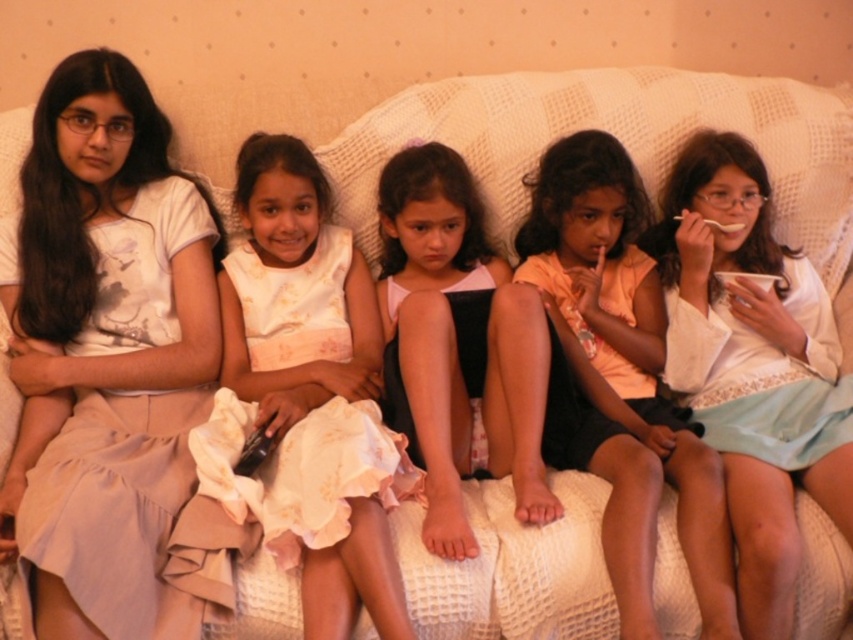
Question: Can you confirm if white cotton dress at left is bigger than matte black dress at center?

Choices:
 (A) no
 (B) yes

Answer: (B)

Question: Observing the image, what is the correct spatial positioning of white cotton dress at left in reference to matte black dress at center?

Choices:
 (A) below
 (B) above

Answer: (A)

Question: Which is farther from the light pink fabric dress at center?

Choices:
 (A) white cotton dress at left
 (B) light pink satin dress at center
 (C) matte black dress at center
 (D) white cotton dress at center

Answer: (A)

Question: Which object is positioned closest to the light pink fabric dress at center?

Choices:
 (A) white cotton dress at center
 (B) matte black dress at center

Answer: (A)

Question: Is white cotton dress at left bigger than light pink satin dress at center?

Choices:
 (A) no
 (B) yes

Answer: (B)

Question: Which point is closer to the camera taking this photo?

Choices:
 (A) (590, 371)
 (B) (456, 344)

Answer: (B)